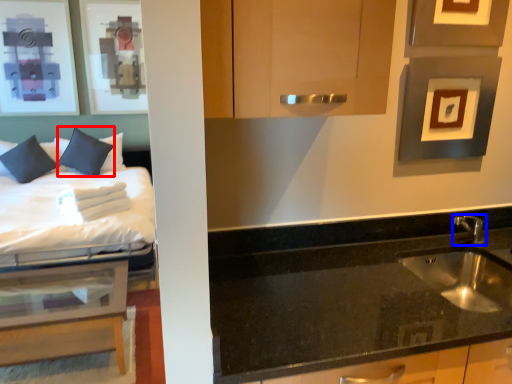
Question: Which of the following is the farthest to the observer, pillow (highlighted by a red box) or tap (highlighted by a blue box)?

Choices:
 (A) pillow
 (B) tap

Answer: (A)